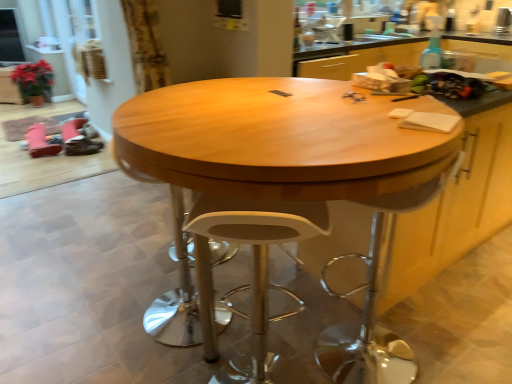
At what (x,y) coordinates should I click in order to perform the action: click on free space to the left of wooden table at center. Please return your answer as a coordinate pair (x, y). Image resolution: width=512 pixels, height=384 pixels. Looking at the image, I should click on pos(76,302).